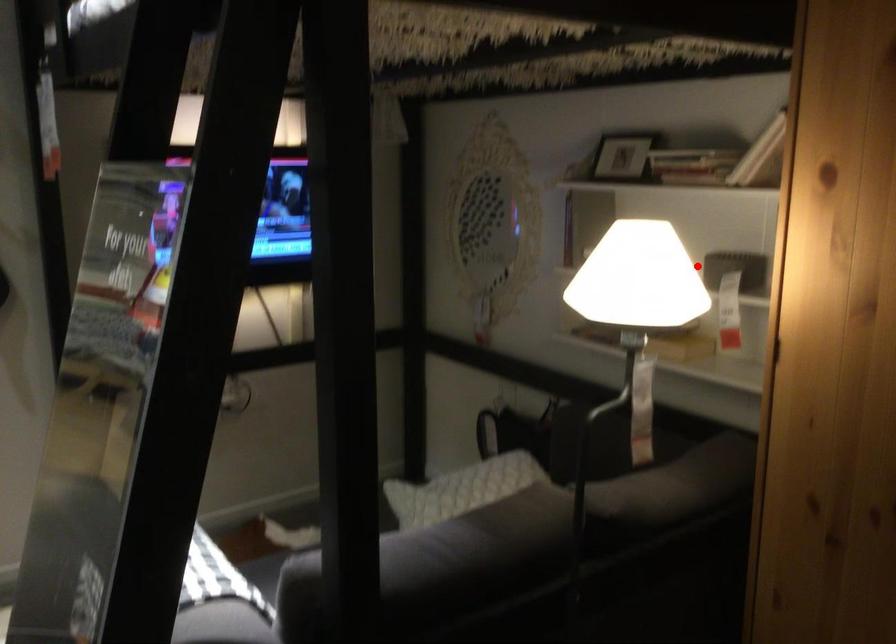
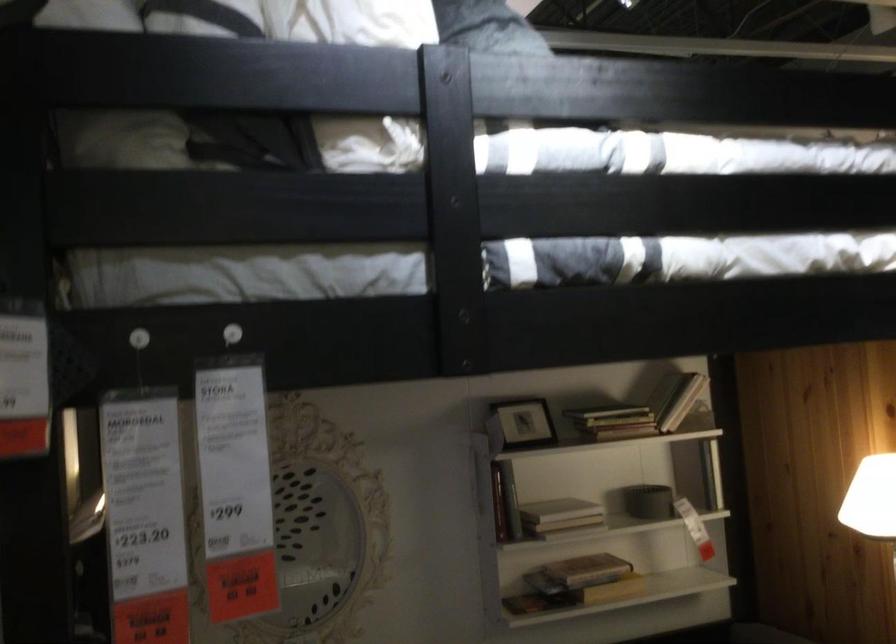
Question: I am providing you with two images of the same scene from different viewpoints. In image1, a red point is highlighted. Considering the same 3D point in image2, which of the following is correct?

Choices:
 (A) It is closer
 (B) It is farther

Answer: (B)